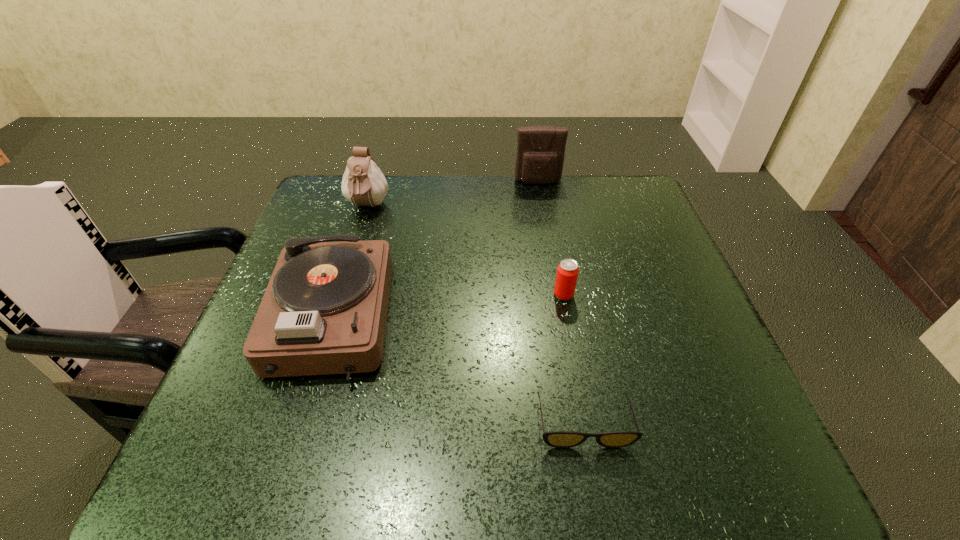
Where is `the farthest object`? The height and width of the screenshot is (540, 960). the farthest object is located at coordinates (540, 149).

At what (x,y) coordinates should I click in order to perform the action: click on the right pouch. Please return your answer as a coordinate pair (x, y). The height and width of the screenshot is (540, 960). Looking at the image, I should click on (540, 149).

Where is `the nearer pouch`? the nearer pouch is located at coordinates (363, 184).

In order to click on the left pouch in this screenshot , I will do `click(363, 184)`.

Where is `record player`? record player is located at coordinates (324, 311).

This screenshot has height=540, width=960. What are the coordinates of `beer can` in the screenshot? It's located at (567, 272).

You are a GUI agent. You are given a task and a screenshot of the screen. Output one action in this format:
    pyautogui.click(x=<x>, y=<y>)
    Task: Click on the shortest object
    Image resolution: width=960 pixels, height=540 pixels.
    Given the screenshot: What is the action you would take?
    pyautogui.click(x=559, y=439)

Locate an element on the screen. The width and height of the screenshot is (960, 540). sunglasses is located at coordinates (559, 439).

Locate an element on the screen. vacant space situated 0.180m with an open flap on the right pouch is located at coordinates (545, 226).

Identify the location of blank space located 0.240m on the front-facing side of the left pouch. (341, 289).